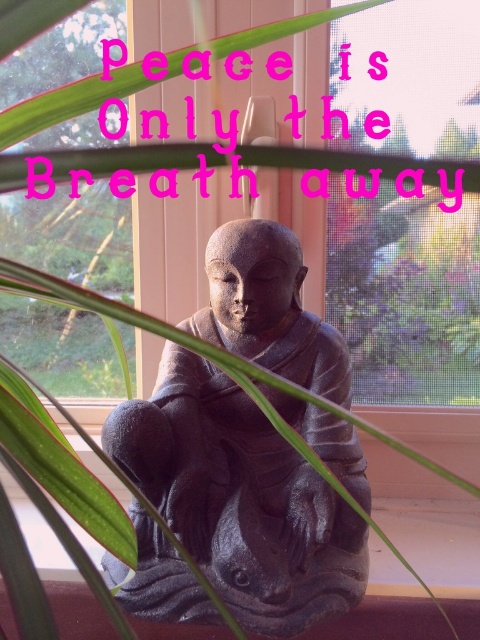
Is matte gray stone statue at center to the right of transparent mesh at center from the viewer's perspective?

In fact, matte gray stone statue at center is to the left of transparent mesh at center.

Who is more forward, [249,292] or [459,227]?

Point [249,292]

In order to click on matte gray stone statue at center in this screenshot , I will do `click(240, 497)`.